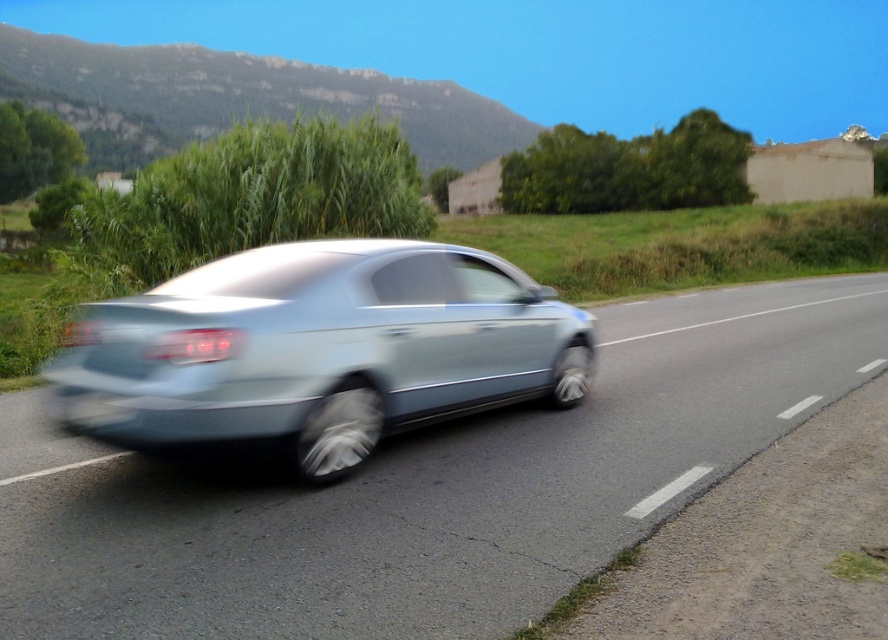
Does satin silver car at center appear on the right side of black rubber license plate at rear?

Yes, satin silver car at center is to the right of black rubber license plate at rear.

Can you confirm if satin silver car at center is positioned above black rubber license plate at rear?

Yes.

Is point (373, 349) closer to camera compared to point (94, 404)?

No, (373, 349) is further to viewer.

This screenshot has height=640, width=888. What are the coordinates of `satin silver car at center` in the screenshot? It's located at (323, 348).

Which of these two, metallic silver car at center or black rubber license plate at rear, stands taller?

metallic silver car at center is taller.

Is point (657, 388) closer to camera compared to point (100, 394)?

No, (657, 388) is behind (100, 394).

Does point (466, 592) lie behind point (105, 404)?

No, it is in front of (105, 404).

Where is `metallic silver car at center`? The width and height of the screenshot is (888, 640). metallic silver car at center is located at coordinates (427, 490).

Does metallic silver car at center have a smaller size compared to satin silver car at center?

Correct, metallic silver car at center occupies less space than satin silver car at center.

Is metallic silver car at center wider than satin silver car at center?

Yes, metallic silver car at center is wider than satin silver car at center.

Which is in front, point (353, 577) or point (171, 305)?

Point (353, 577) is in front.

This screenshot has width=888, height=640. What are the coordinates of `metallic silver car at center` in the screenshot? It's located at (427, 490).